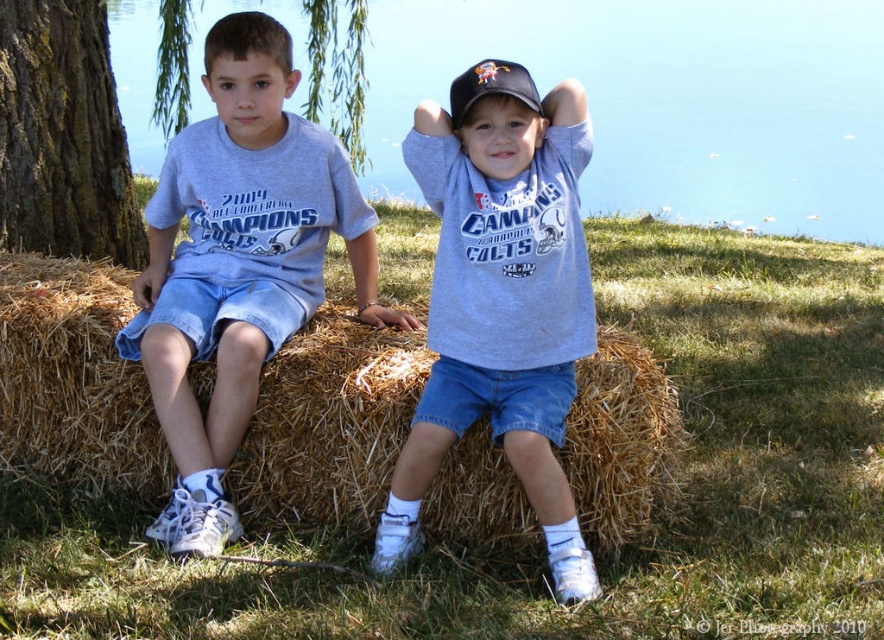
Question: Does blue water at upper center appear under matte gray t-shirt at center?

Choices:
 (A) yes
 (B) no

Answer: (B)

Question: Is brown straw bale at center to the right of gray cotton t-shirt at left from the viewer's perspective?

Choices:
 (A) yes
 (B) no

Answer: (B)

Question: Which of the following is the farthest from the observer?

Choices:
 (A) brown straw bale at center
 (B) blue water at upper center
 (C) brown rough bark tree at left

Answer: (C)

Question: Is matte gray t-shirt at center above brown rough bark tree at left?

Choices:
 (A) no
 (B) yes

Answer: (A)

Question: Which object is farther from the camera taking this photo?

Choices:
 (A) matte gray t-shirt at center
 (B) brown straw bale at center
 (C) blue water at upper center

Answer: (C)

Question: Which point is closer to the camera?

Choices:
 (A) matte gray t-shirt at center
 (B) brown rough bark tree at left

Answer: (A)